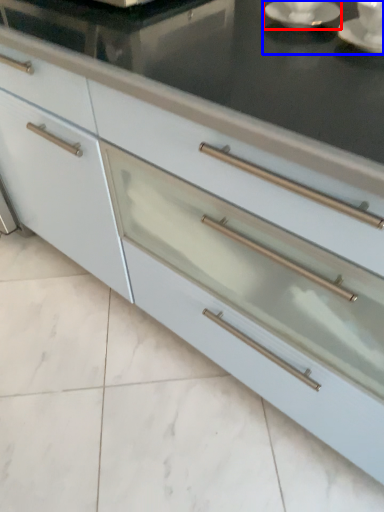
Question: Which object is further to the camera taking this photo, saucer (highlighted by a red box) or tea set (highlighted by a blue box)?

Choices:
 (A) saucer
 (B) tea set

Answer: (B)